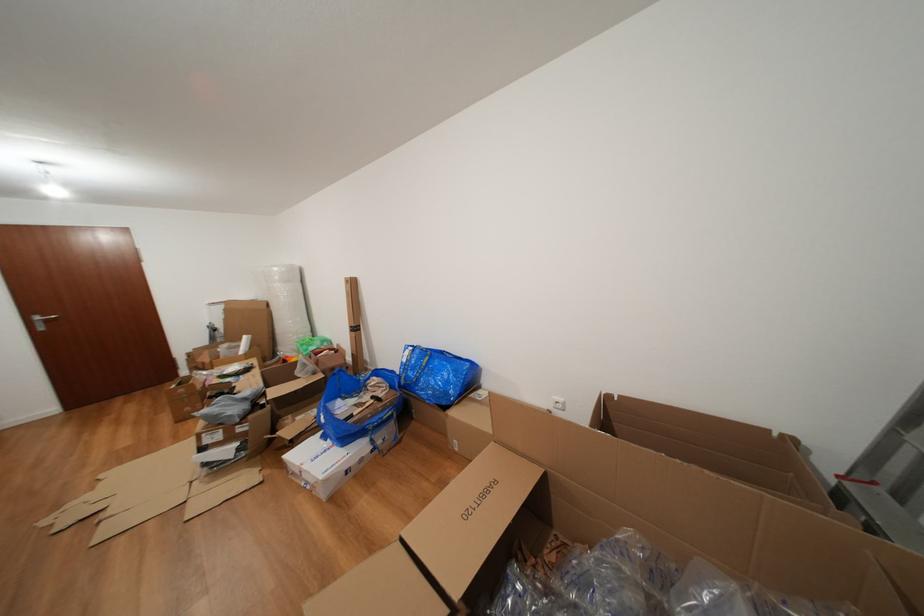
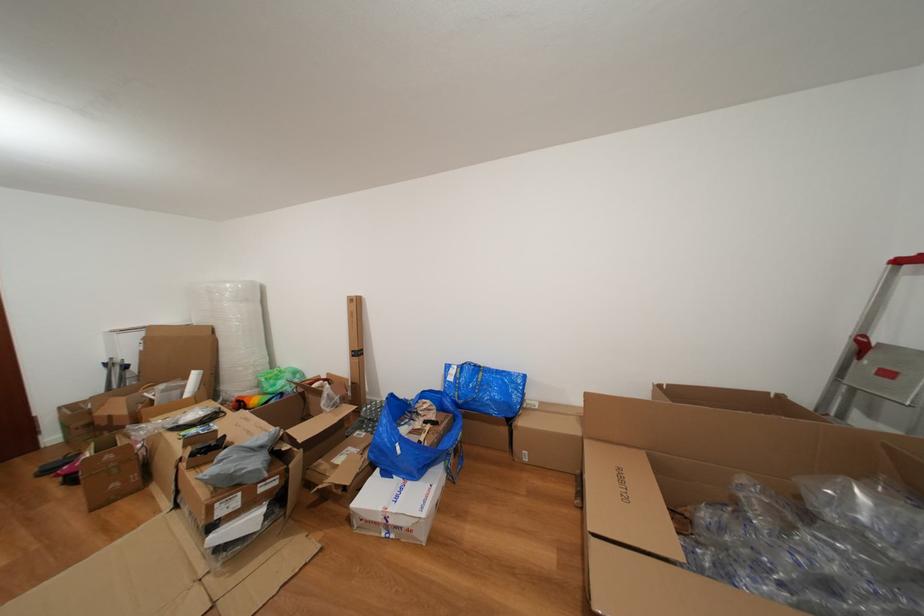
Locate, in the second image, the point that corresponds to point 332,440 in the first image.

(394, 479)